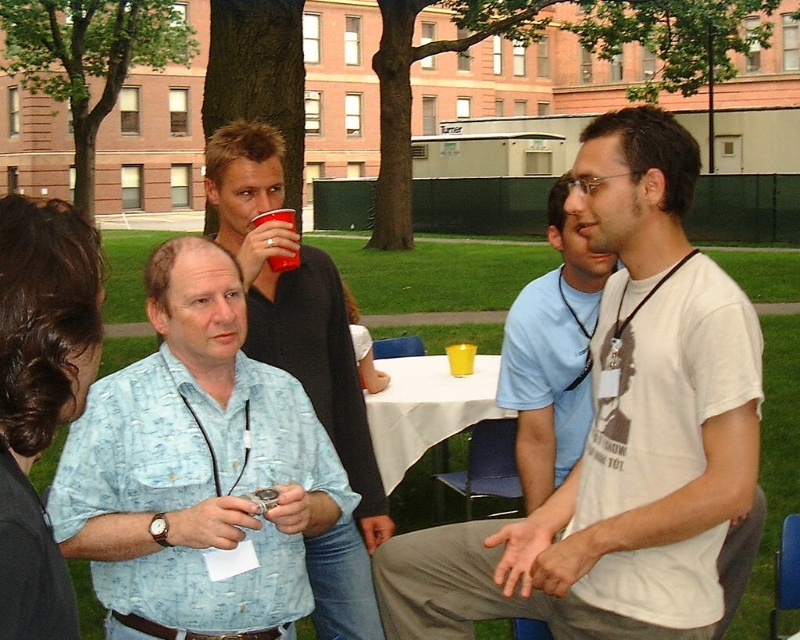
Question: Among these objects, which one is farthest from the camera?

Choices:
 (A) white cloth table at center
 (B) matte black shirt at center

Answer: (A)

Question: Does white matte t-shirt at center have a larger size compared to white cloth table at center?

Choices:
 (A) no
 (B) yes

Answer: (B)

Question: Can you confirm if light blue printed shirt at center is positioned to the left of light blue t-shirt at center?

Choices:
 (A) yes
 (B) no

Answer: (A)

Question: Among these objects, which one is nearest to the camera?

Choices:
 (A) white matte t-shirt at center
 (B) light blue printed shirt at center
 (C) matte black shirt at center
 (D) red plastic cup at upper center

Answer: (B)

Question: Is matte black shirt at center below white cloth table at center?

Choices:
 (A) yes
 (B) no

Answer: (B)

Question: Which object appears farthest from the camera in this image?

Choices:
 (A) white cloth table at center
 (B) white matte t-shirt at center

Answer: (A)